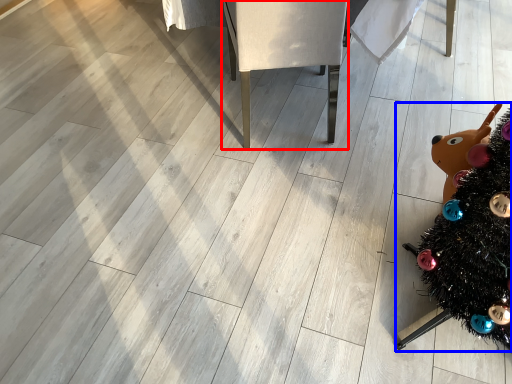
Question: Which object is further to the camera taking this photo, furniture (highlighted by a red box) or christmas tree (highlighted by a blue box)?

Choices:
 (A) furniture
 (B) christmas tree

Answer: (A)